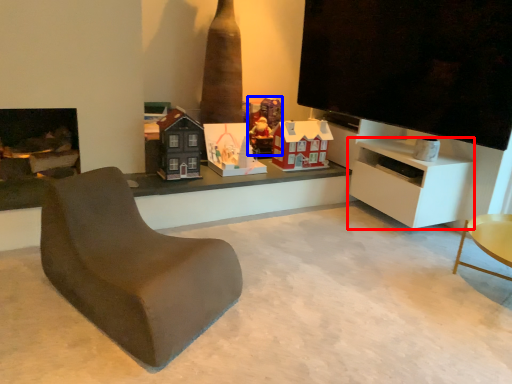
Question: Among these objects, which one is nearest to the camera, cabinetry (highlighted by a red box) or toy (highlighted by a blue box)?

Choices:
 (A) cabinetry
 (B) toy

Answer: (A)